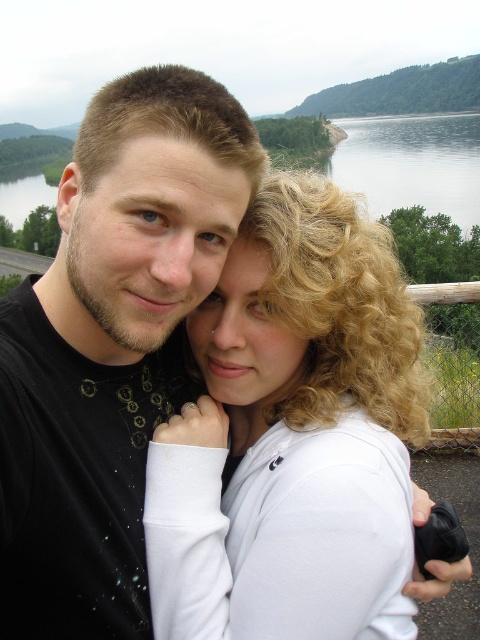
Question: Considering the relative positions of white matte hair at center and black matte shirt at center in the image provided, where is white matte hair at center located with respect to black matte shirt at center?

Choices:
 (A) above
 (B) below

Answer: (B)

Question: Considering the relative positions of black matte shirt at center and transparent water at upper center in the image provided, where is black matte shirt at center located with respect to transparent water at upper center?

Choices:
 (A) above
 (B) below

Answer: (B)

Question: Which object is farther from the camera taking this photo?

Choices:
 (A) transparent water at upper center
 (B) black matte shirt at center
 (C) white matte hair at center

Answer: (A)

Question: Which of these objects is positioned farthest from the white matte hair at center?

Choices:
 (A) transparent water at upper center
 (B) black matte shirt at center

Answer: (A)

Question: Can you confirm if white matte hair at center is thinner than black matte shirt at center?

Choices:
 (A) no
 (B) yes

Answer: (B)

Question: Estimate the real-world distances between objects in this image. Which object is closer to the black matte shirt at center?

Choices:
 (A) transparent water at upper center
 (B) white matte hair at center

Answer: (B)